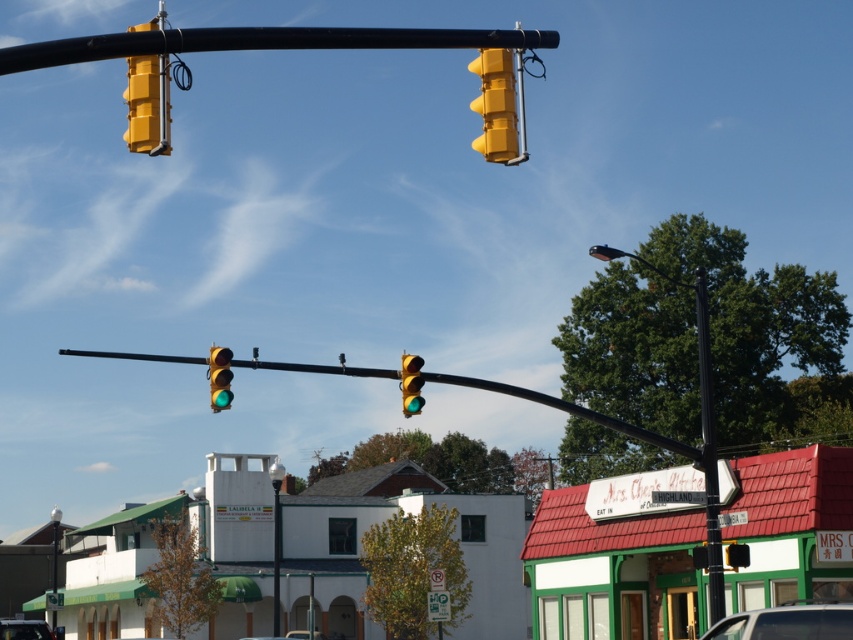
Question: Which of these objects is positioned farthest from the yellow plastic traffic light at upper center?

Choices:
 (A) white matte building at center
 (B) metallic street light at lower left
 (C) white matte car at center
 (D) black metal street light at upper right

Answer: (B)

Question: Among these points, which one is farthest from the camera?

Choices:
 (A) (717, 467)
 (B) (144, 76)
 (C) (33, 627)
 (D) (292, 636)

Answer: (D)

Question: Does green matte traffic light at center appear under metallic silver car at lower left?

Choices:
 (A) yes
 (B) no

Answer: (B)

Question: Can you confirm if yellow matte traffic light at upper left is thinner than green matte traffic light at center?

Choices:
 (A) no
 (B) yes

Answer: (A)

Question: Based on their relative distances, which object is nearer to the black metal pole at center?

Choices:
 (A) green matte traffic light at center
 (B) metallic pole at center

Answer: (A)

Question: Does black metal street light at upper right have a lesser width compared to metallic silver car at lower left?

Choices:
 (A) yes
 (B) no

Answer: (A)